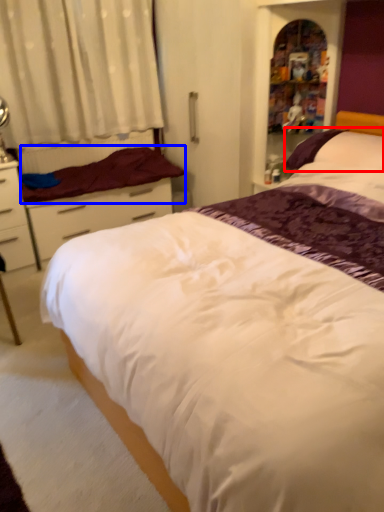
Question: Which of the following is the farthest to the observer, pillow (highlighted by a red box) or mattress (highlighted by a blue box)?

Choices:
 (A) pillow
 (B) mattress

Answer: (B)